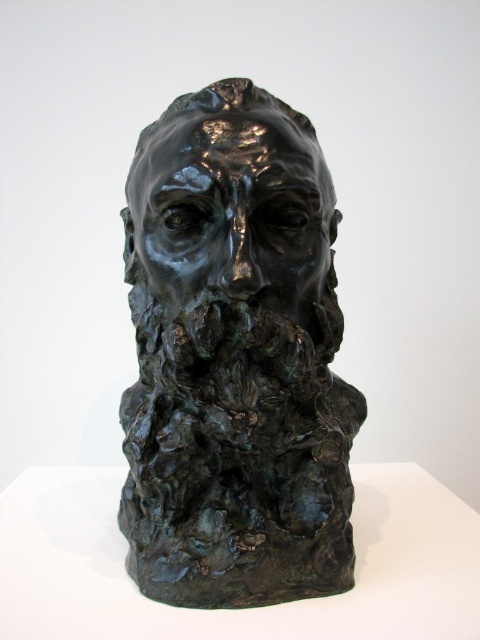
You are an art conservator examining the sculpture. You notice a small crack at the point labeled point (235, 358). Based on the sculpture description, where is this crack located?

The point (235, 358) corresponds to the bronze textured head at center, so the crack is located on the bronze textured head at center.

You are an art conservator assessing the bronze sculpture. You need to determine which part of the sculpture is wider for proper restoration. Which is wider, the bronze textured head at center or the shiny bronze face at center?

The bronze textured head at center is wider than the shiny bronze face at center according to the description.

You are an art conservator examining the sculpture. You notice two distinct areas on the sculpture. One is the bronze textured head at center and the shiny bronze face at center. Which area is located above the other?

The shiny bronze face at center is above the bronze textured head at center because the bronze textured head at center is positioned under the shiny bronze face at center.